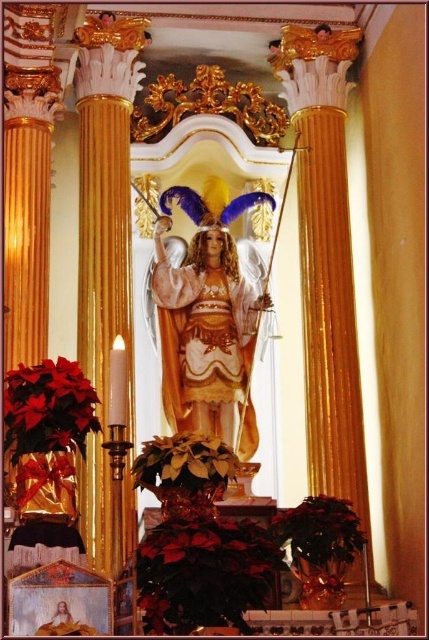
Does point (199, 477) come closer to viewer compared to point (314, 508)?

Yes, point (199, 477) is in front of point (314, 508).

Is green leafy plant at center shorter than green matte poinsettia at lower right?

Yes.

Is point (181, 440) positioned before point (320, 500)?

Yes.

Find the location of a particular element. The width and height of the screenshot is (429, 640). green leafy plant at center is located at coordinates (184, 464).

Which is in front, point (75, 400) or point (359, 531)?

Point (75, 400)

Between shiny red poinsettia at lower left and green matte poinsettia at lower right, which one is positioned higher?

shiny red poinsettia at lower left is above.

Between point (21, 380) and point (310, 529), which one is positioned in front?

Point (21, 380)

Identify the location of shiny red poinsettia at lower left. The width and height of the screenshot is (429, 640). (48, 408).

Between gold textured statue at center and green leafy plant at center, which one is positioned lower?

green leafy plant at center

Between point (259, 195) and point (133, 483), which one is positioned in front?

Point (133, 483) is more forward.

Is point (196, 236) closer to camera compared to point (181, 451)?

No, (196, 236) is further to viewer.

Find the location of a particular element. Image resolution: width=429 pixels, height=640 pixels. gold textured statue at center is located at coordinates (208, 320).